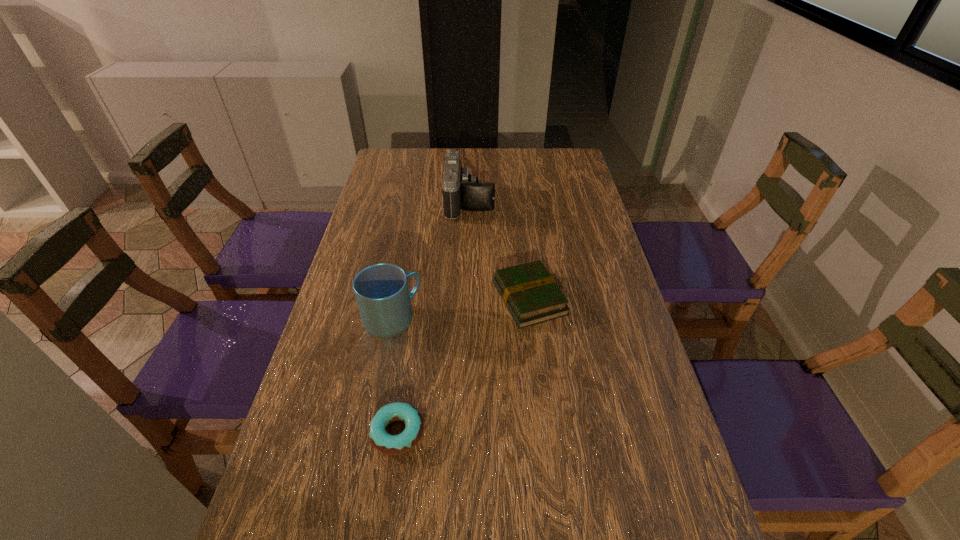
I want to click on camera, so click(x=461, y=190).

Find the location of a particular element. This screenshot has width=960, height=540. mug is located at coordinates (381, 290).

At what (x,y) coordinates should I click in order to perform the action: click on the second shortest object. Please return your answer as a coordinate pair (x, y). Looking at the image, I should click on (530, 293).

Identify the location of the shortest object. (384, 442).

The width and height of the screenshot is (960, 540). Identify the location of the nearest object. (384, 442).

In order to click on free space located at the front of the farthest object with an open lens cover in this screenshot , I will do `click(525, 202)`.

The height and width of the screenshot is (540, 960). Identify the location of vacant space located 0.100m on the back of the mug. (401, 275).

Locate an element on the screen. This screenshot has width=960, height=540. vacant area situated on the back of the book is located at coordinates (519, 209).

I want to click on free location located on the right of the nearest object, so click(468, 433).

Identify the location of object that is positioned at the left edge. This screenshot has width=960, height=540. (381, 290).